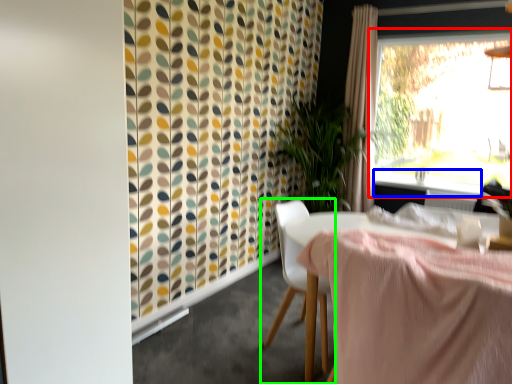
Question: Based on their relative distances, which object is nearer to window (highlighted by a red box)? Choose from window sill (highlighted by a blue box) and chair (highlighted by a green box).

Choices:
 (A) window sill
 (B) chair

Answer: (A)